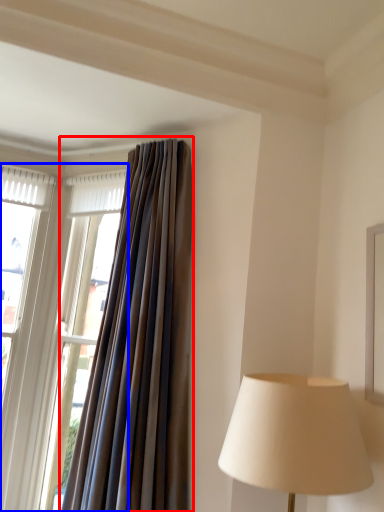
Question: Among these objects, which one is nearest to the camera, curtain (highlighted by a red box) or window (highlighted by a blue box)?

Choices:
 (A) curtain
 (B) window

Answer: (A)